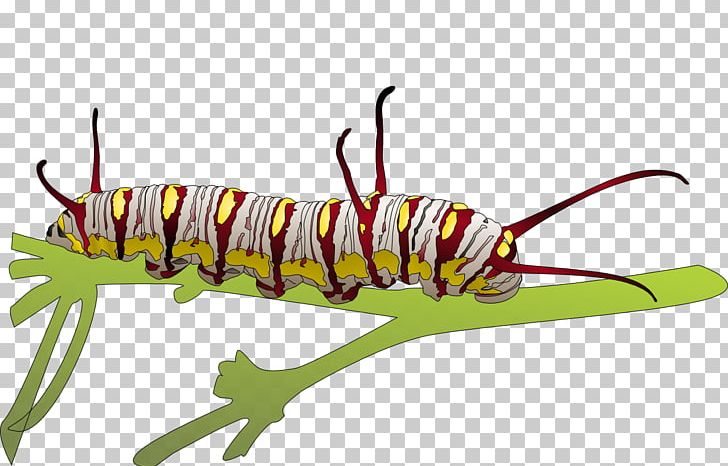
Locate an element on the screen. pots is located at coordinates (346, 267).